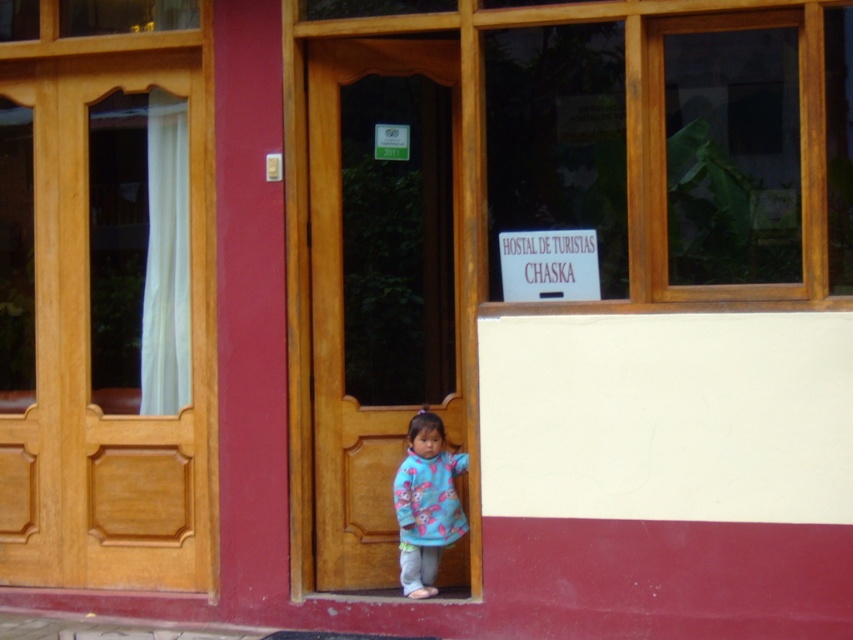
Is wooden door at left taller than fluffy fleece sweater at center?

Indeed, wooden door at left has a greater height compared to fluffy fleece sweater at center.

Between wooden door at left and fluffy fleece sweater at center, which one has less height?

Standing shorter between the two is fluffy fleece sweater at center.

Between point (199, 500) and point (427, 531), which one is positioned behind?

Positioned behind is point (199, 500).

I want to click on wooden door at left, so click(x=105, y=324).

Which is behind, point (445, 58) or point (450, 490)?

Positioned behind is point (445, 58).

Does point (367, 461) come closer to viewer compared to point (438, 506)?

That is False.

Find the location of a particular element. The width and height of the screenshot is (853, 640). wooden door at center is located at coordinates (379, 284).

Where is `wooden door at left`? This screenshot has height=640, width=853. wooden door at left is located at coordinates (105, 324).

Does point (97, 225) come farther from viewer compared to point (316, 80)?

Yes, point (97, 225) is behind point (316, 80).

What are the coordinates of `wooden door at left` in the screenshot? It's located at (105, 324).